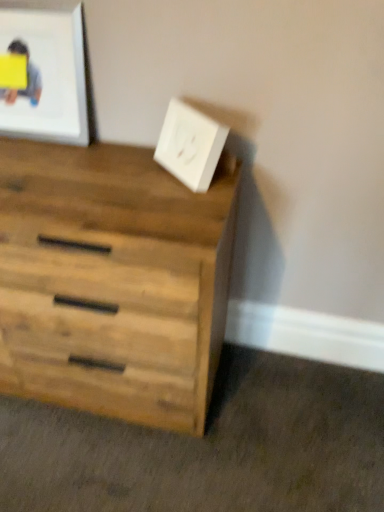
Identify the location of vacant area that is in front of white matte electric outlet at upper right. This screenshot has height=512, width=384. pos(181,205).